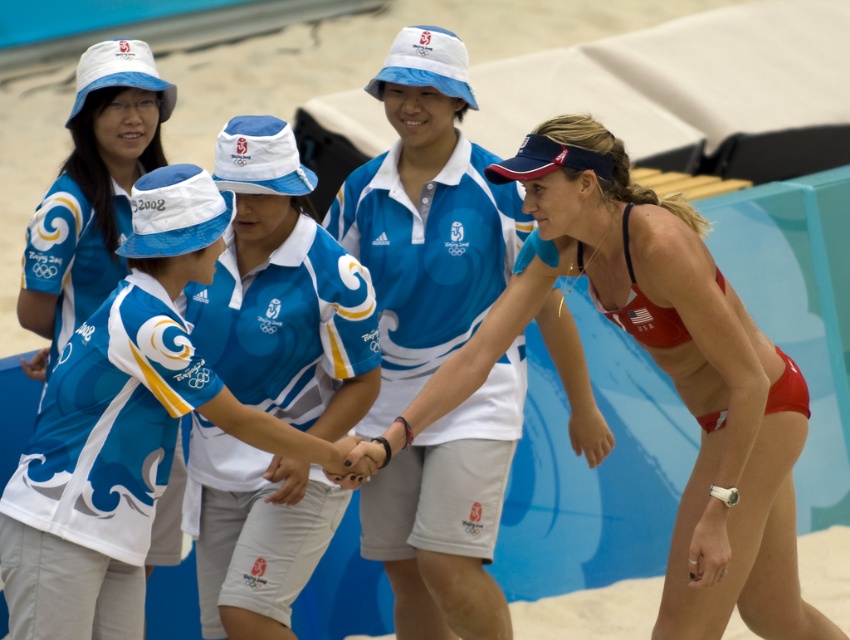
Question: Based on their relative distances, which object is nearer to the white fabric uniform at center?

Choices:
 (A) blue and white jersey at center
 (B) light blue fabric shirt at center
 (C) white matte uniform at center
 (D) matte blue hat at upper left

Answer: (C)

Question: Which is nearer to the matte red bikini at center?

Choices:
 (A) white matte uniform at center
 (B) light blue fabric shirt at center
 (C) blue and white jersey at center
 (D) white fabric uniform at center

Answer: (C)

Question: Based on their relative distances, which object is farther from the matte red bikini at center?

Choices:
 (A) light blue fabric shirt at center
 (B) matte blue hat at upper left

Answer: (B)

Question: In this image, where is white matte uniform at center located relative to matte blue hat at upper left?

Choices:
 (A) above
 (B) below

Answer: (B)

Question: Can you confirm if white fabric uniform at center is positioned to the left of light blue fabric shirt at center?

Choices:
 (A) no
 (B) yes

Answer: (A)

Question: Does white fabric uniform at center appear on the right side of light blue fabric shirt at center?

Choices:
 (A) no
 (B) yes

Answer: (B)